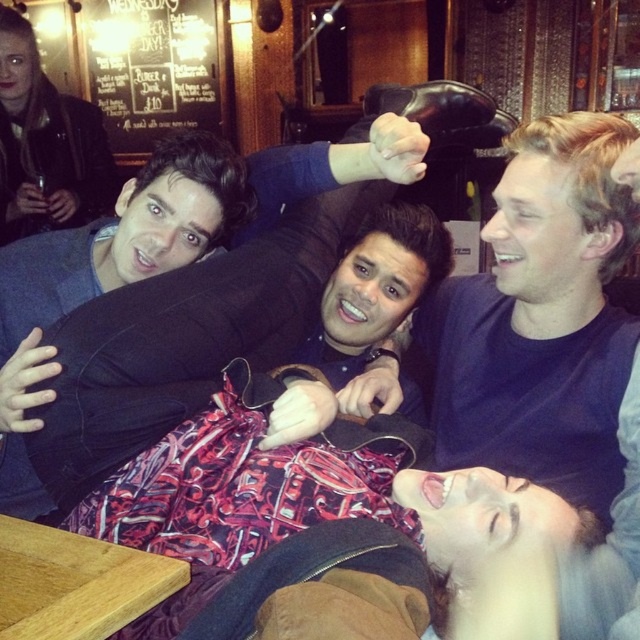
Question: Which is nearer to the dark blue sweater at center?

Choices:
 (A) black chalkboard menu at upper left
 (B) dark blue t-shirt at center

Answer: (B)

Question: From the image, what is the correct spatial relationship of dark blue sweater at center in relation to black chalkboard menu at upper left?

Choices:
 (A) above
 (B) below

Answer: (B)

Question: Does dark blue sweater at center appear on the right side of black chalkboard menu at upper left?

Choices:
 (A) yes
 (B) no

Answer: (A)

Question: Which of these objects is positioned farthest from the dark blue sweater at center?

Choices:
 (A) black chalkboard menu at upper left
 (B) dark blue t-shirt at center

Answer: (A)

Question: Considering the relative positions of dark blue t-shirt at center and dark blue sweater at center in the image provided, where is dark blue t-shirt at center located with respect to dark blue sweater at center?

Choices:
 (A) right
 (B) left

Answer: (A)

Question: Among these points, which one is farthest from the camera?

Choices:
 (A) (x=16, y=392)
 (B) (x=605, y=342)

Answer: (B)